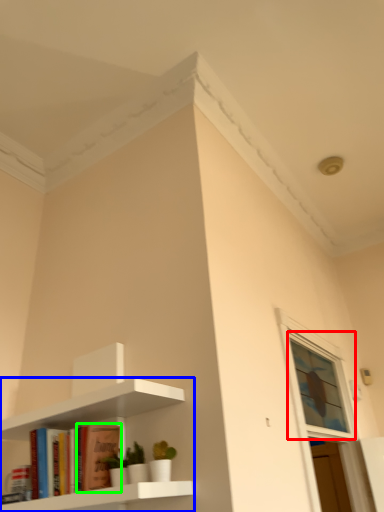
Question: Which object is the farthest from window (highlighted by a red box)? Choose among these: shelf (highlighted by a blue box) or book (highlighted by a green box).

Choices:
 (A) shelf
 (B) book

Answer: (B)